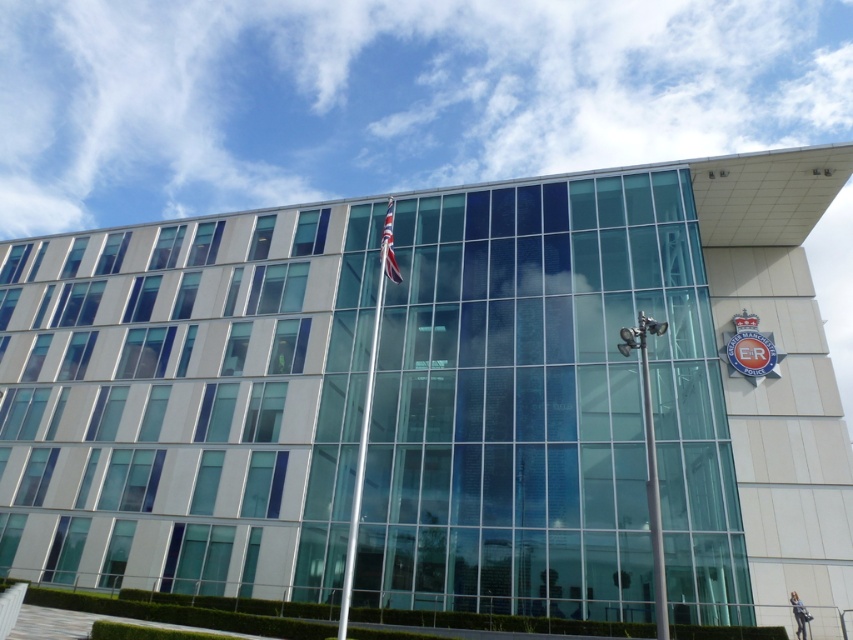
You are standing in front of the modern building with a flagpole. There is a point marked at coordinates (367, 412). Based on the scene description, where exactly is this point located?

The point at (367, 412) is on the silver metallic flag pole at center.

You are a visitor approaching the building and see the silver metallic flag pole at center and the red flag at upper center. Which object is closer to the sky?

The red flag at upper center is closer to the sky because it is positioned above the silver metallic flag pole at center.